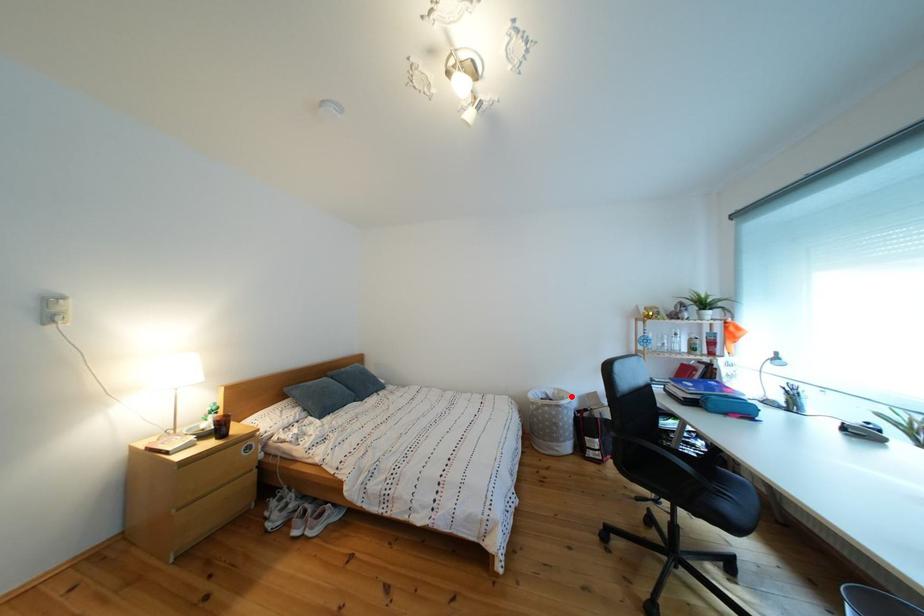
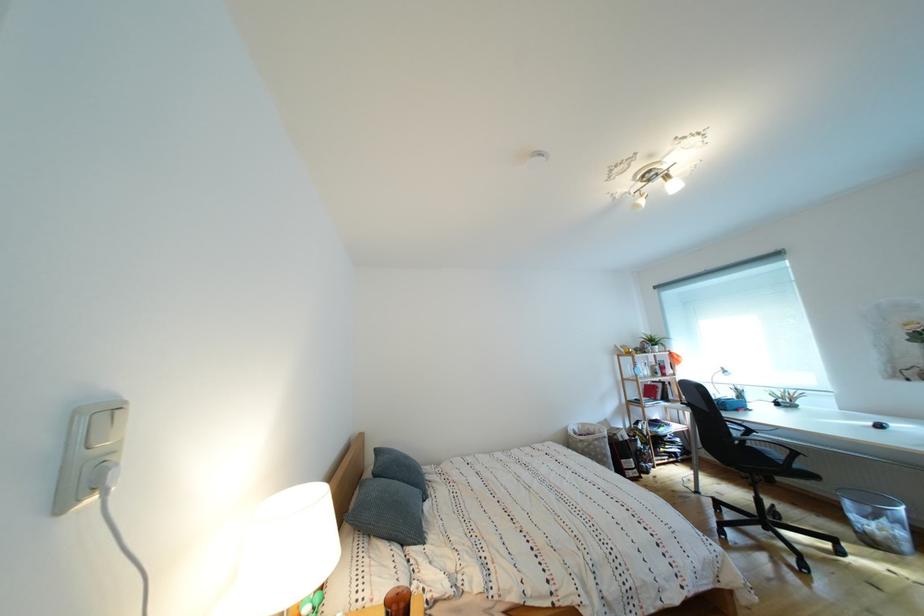
Where in the second image is the point corresponding to the highlighted location from the first image?

(594, 430)